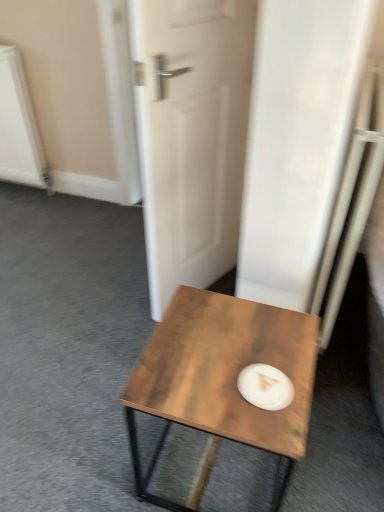
Question: Is wooden coffee table at center wider than white matte paper plate at center?

Choices:
 (A) yes
 (B) no

Answer: (A)

Question: Does wooden coffee table at center have a greater height compared to white matte paper plate at center?

Choices:
 (A) no
 (B) yes

Answer: (B)

Question: Considering the relative sizes of wooden coffee table at center and white matte paper plate at center in the image provided, is wooden coffee table at center bigger than white matte paper plate at center?

Choices:
 (A) yes
 (B) no

Answer: (A)

Question: From the image's perspective, is wooden coffee table at center located beneath white matte paper plate at center?

Choices:
 (A) no
 (B) yes

Answer: (B)

Question: From the image's perspective, is wooden coffee table at center over white matte paper plate at center?

Choices:
 (A) no
 (B) yes

Answer: (A)

Question: Considering the positions of point (198, 351) and point (286, 378), is point (198, 351) closer or farther from the camera than point (286, 378)?

Choices:
 (A) farther
 (B) closer

Answer: (A)

Question: Based on their sizes in the image, would you say wooden coffee table at center is bigger or smaller than white matte paper plate at center?

Choices:
 (A) big
 (B) small

Answer: (A)

Question: From the image's perspective, is wooden coffee table at center above or below white matte paper plate at center?

Choices:
 (A) above
 (B) below

Answer: (B)

Question: Considering their positions, is wooden coffee table at center located in front of or behind white matte paper plate at center?

Choices:
 (A) behind
 (B) front

Answer: (B)

Question: From a real-world perspective, is white matte door at center physically located above or below white matte paper plate at center?

Choices:
 (A) above
 (B) below

Answer: (A)

Question: Is white matte door at center situated inside white matte paper plate at center or outside?

Choices:
 (A) inside
 (B) outside

Answer: (B)

Question: In terms of height, does white matte door at center look taller or shorter compared to white matte paper plate at center?

Choices:
 (A) short
 (B) tall

Answer: (B)

Question: Considering the positions of white matte door at center and white matte paper plate at center in the image, is white matte door at center wider or thinner than white matte paper plate at center?

Choices:
 (A) thin
 (B) wide

Answer: (B)

Question: Choose the correct answer: Is white matte door at center inside wooden coffee table at center or outside it?

Choices:
 (A) outside
 (B) inside

Answer: (A)

Question: In terms of width, does white matte door at center look wider or thinner when compared to wooden coffee table at center?

Choices:
 (A) thin
 (B) wide

Answer: (A)